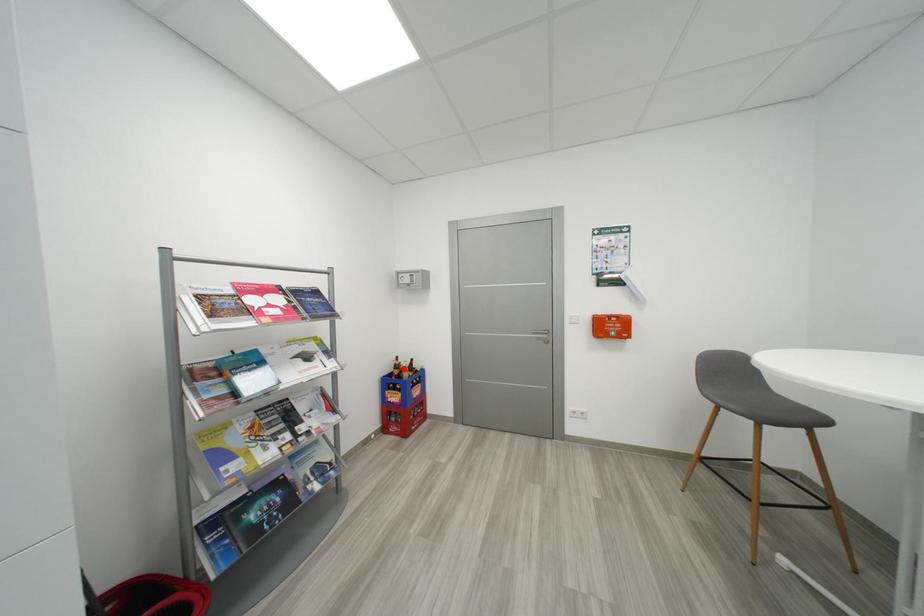
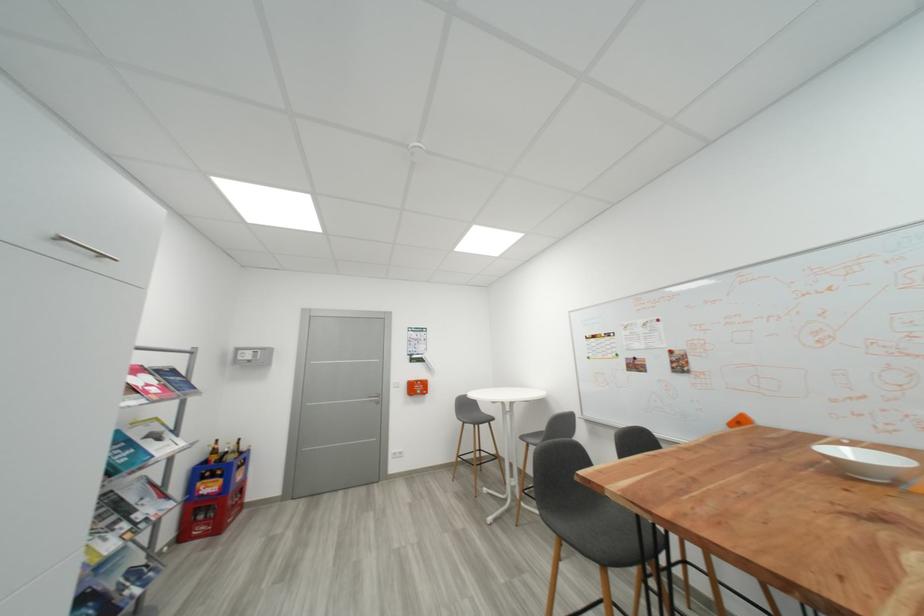
Locate, in the second image, the point that corresponds to the highlighted location in the first image.

(223, 454)